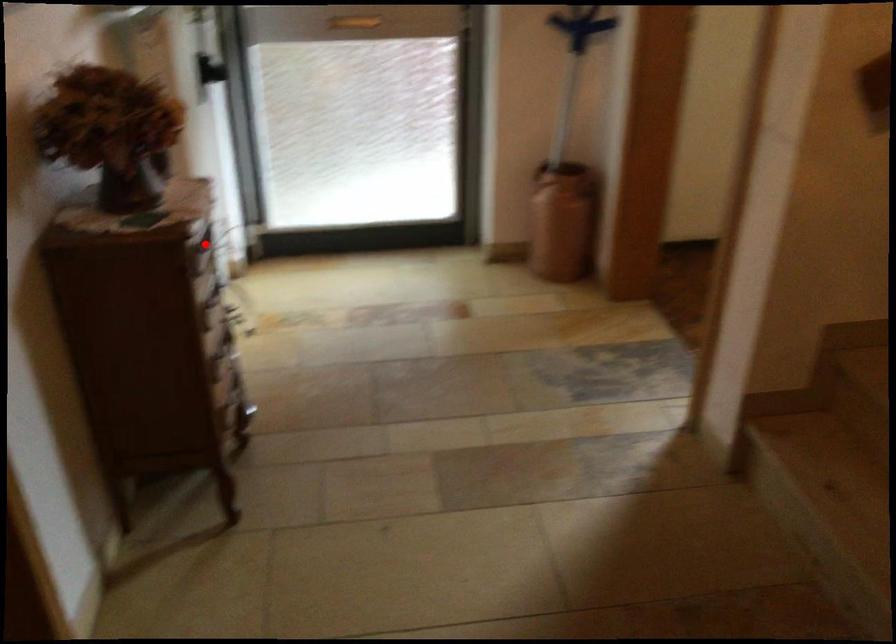
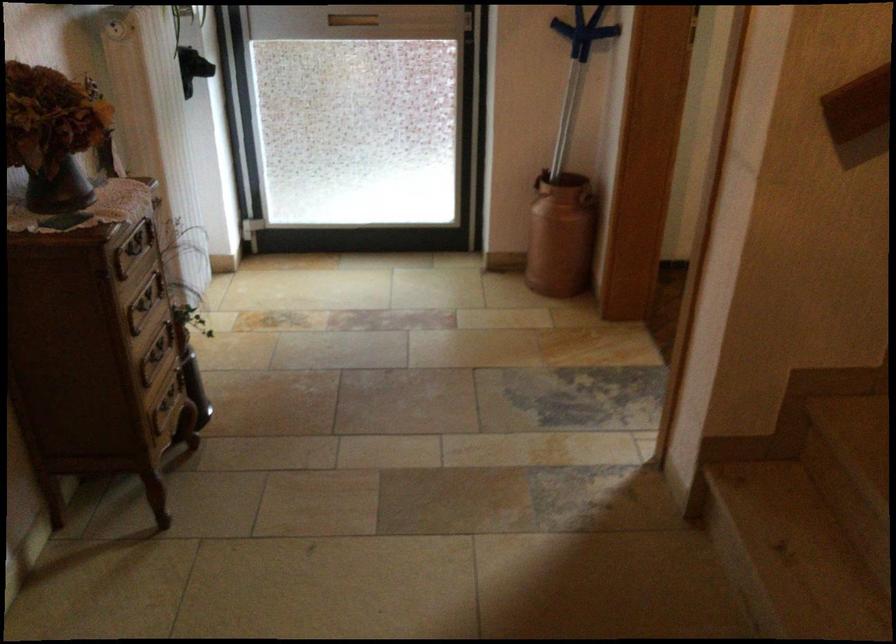
Locate, in the second image, the point that corresponds to the highlighted location in the first image.

(133, 248)